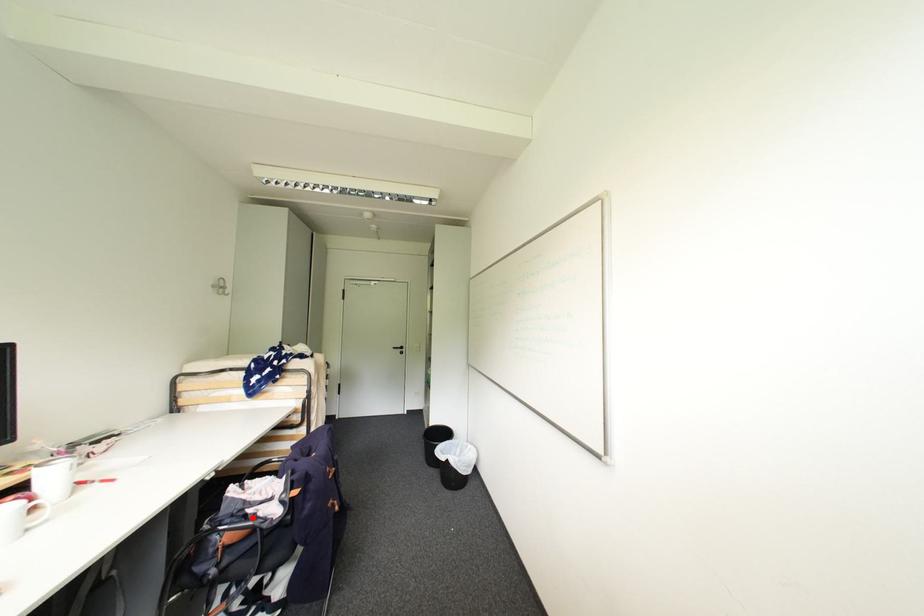
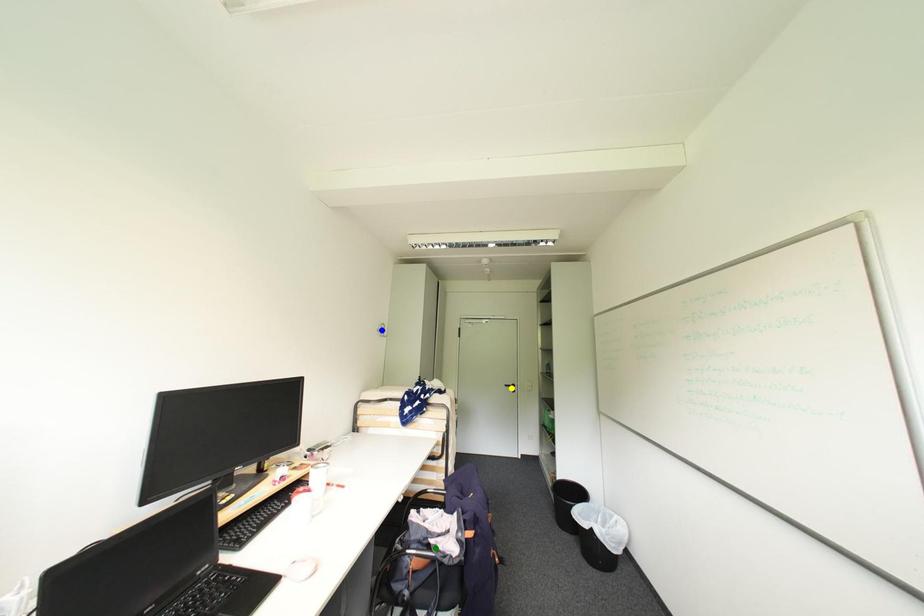
Question: I am providing you with two images of the same scene from different viewpoints. A red point is marked on the first image. You are given multiple points on the second image. Which mark in image 2 goes with the point in image 1?

Choices:
 (A) blue point
 (B) green point
 (C) yellow point

Answer: (B)